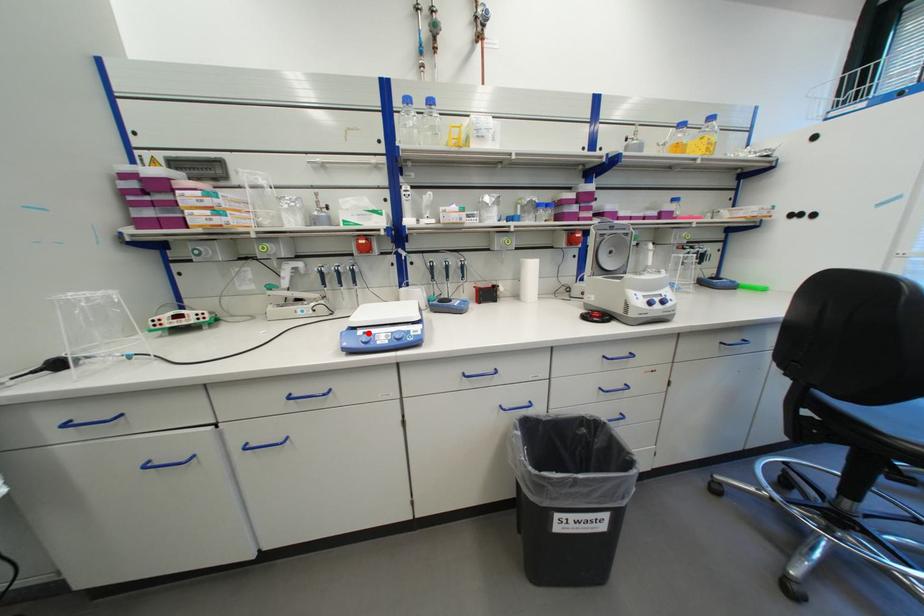
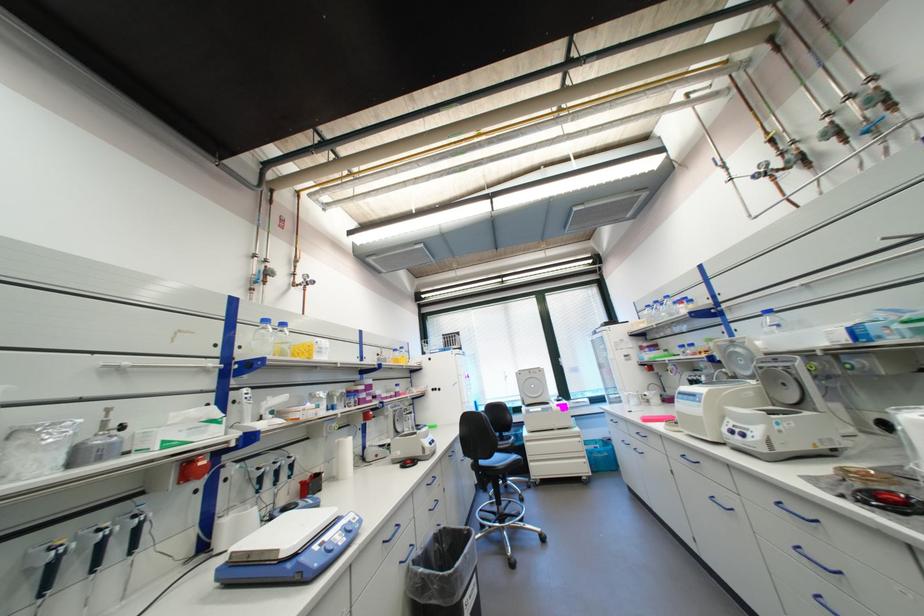
Find the pixel in the second image that matches the highlighted location in the first image.

(323, 548)